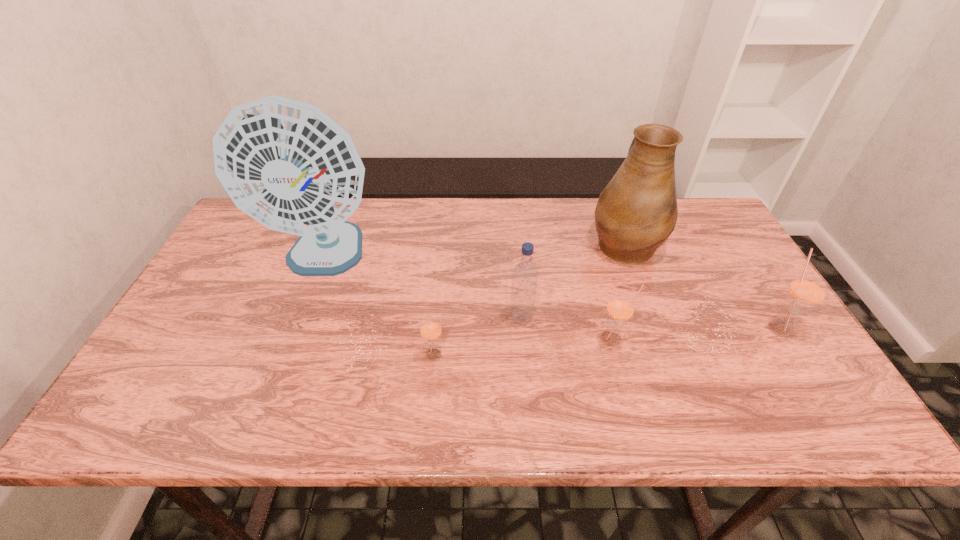
Locate an element on the screen. free point that satisfies the following two spatial constraints: 1. on the grille of the fan; 2. on the left side of the second straw from right to left is located at coordinates (293, 341).

Where is `vacant point that satisfies the following two spatial constraints: 1. on the grille of the leftmost object; 2. on the left side of the rightmost object`? The height and width of the screenshot is (540, 960). vacant point that satisfies the following two spatial constraints: 1. on the grille of the leftmost object; 2. on the left side of the rightmost object is located at coordinates (298, 327).

This screenshot has height=540, width=960. Find the location of `vacant area in the image that satisfies the following two spatial constraints: 1. on the grille of the second shortest straw; 2. on the left side of the tallest object`. vacant area in the image that satisfies the following two spatial constraints: 1. on the grille of the second shortest straw; 2. on the left side of the tallest object is located at coordinates (293, 341).